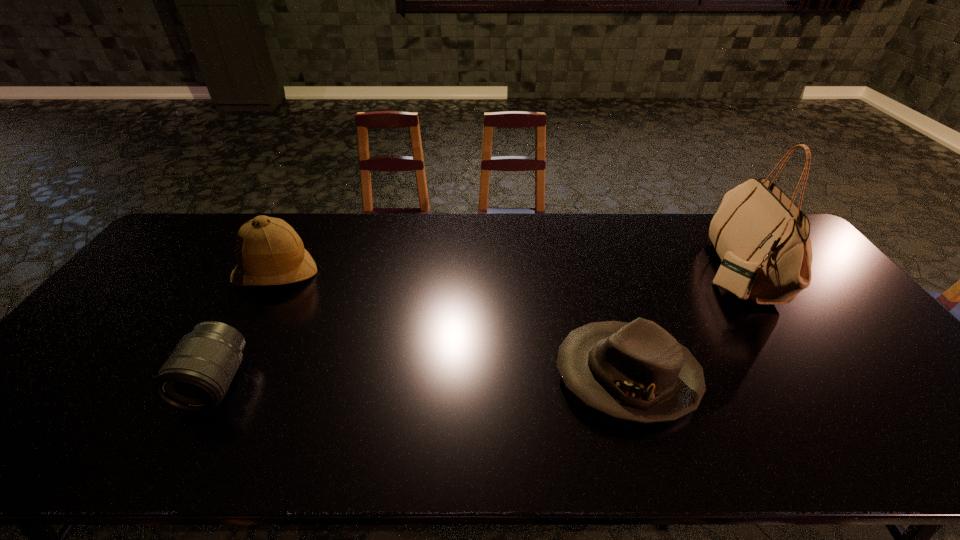
The image size is (960, 540). Find the location of `free location that satisfies the following two spatial constraints: 1. on the decorative side of the shorter hat; 2. on the surface of the telephoto lens`. free location that satisfies the following two spatial constraints: 1. on the decorative side of the shorter hat; 2. on the surface of the telephoto lens is located at coordinates (629, 382).

Locate an element on the screen. free space that satisfies the following two spatial constraints: 1. on the decorative side of the nearer hat; 2. on the surface of the telephoto lens is located at coordinates (629, 382).

The width and height of the screenshot is (960, 540). In order to click on vacant position in the image that satisfies the following two spatial constraints: 1. on the side of the tallest object with the attached pouch; 2. on the surface of the telephoto lens in this screenshot , I will do `click(810, 382)`.